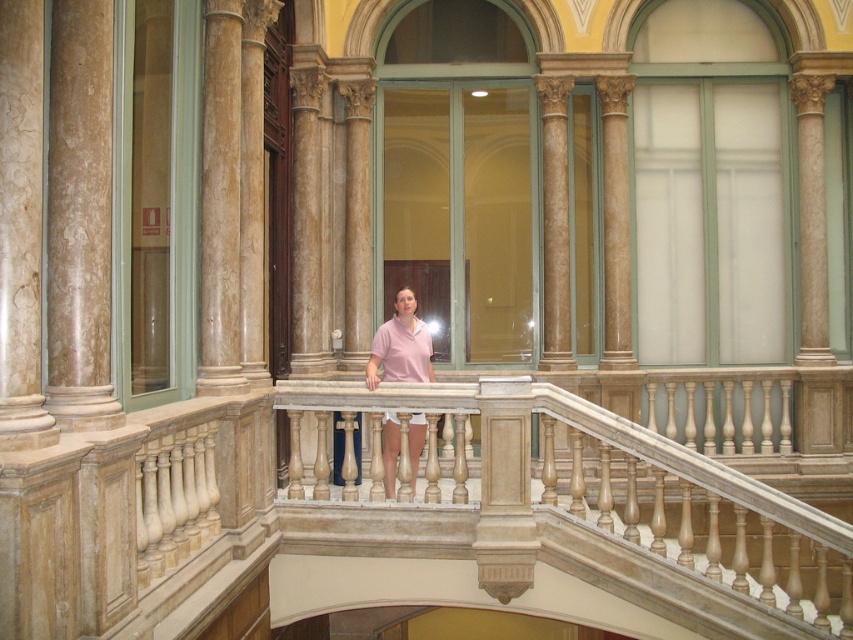
You are standing at the position of the person on the balcony and want to move towards the point labeled point [602,461]. Is this point closer to you than the point labeled point [410,445]?

Yes, point [602,461] is in front of point [410,445], so it is closer to you.

You are a tailor measuring the pink matte shirt at center to ensure it fits properly. The beige marble balustrade at center is in your way. Can you move the balustrade to get a clear view of the shirt?

Result: The beige marble balustrade at center might be wider than the pink matte shirt at center, so moving it might not be feasible due to its potential width.